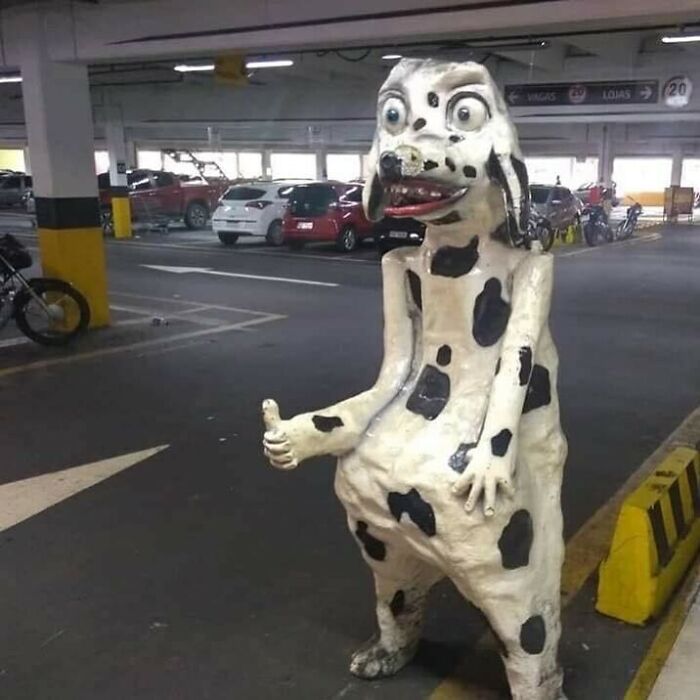
Where is `1 cow statue`? This screenshot has width=700, height=700. 1 cow statue is located at coordinates (470, 393).